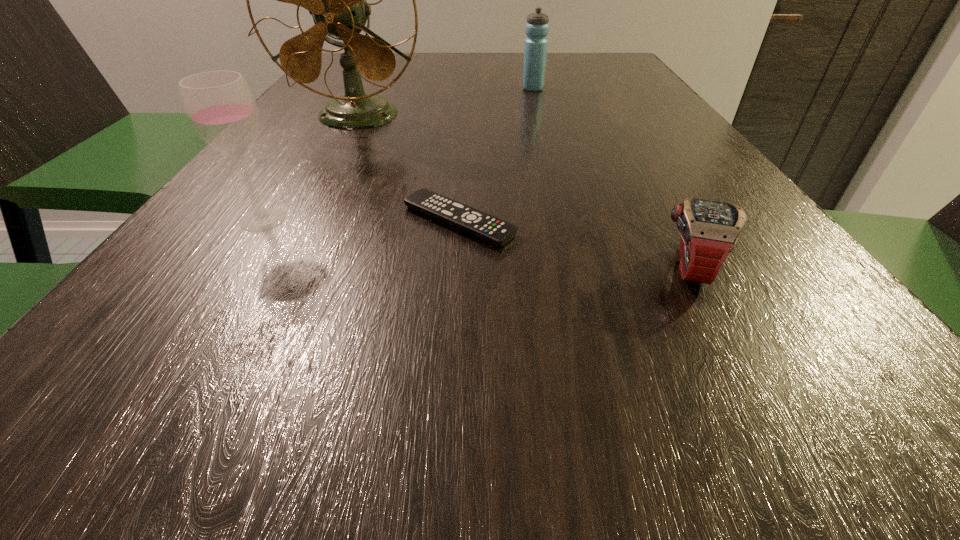
Find the location of a particular element. vacant region located 0.330m on the left of the farthest object is located at coordinates (387, 89).

This screenshot has width=960, height=540. In order to click on free location located 0.110m on the right of the watch in this screenshot , I will do `click(805, 267)`.

This screenshot has width=960, height=540. I want to click on free space located on the left of the remote control, so click(360, 221).

Locate an element on the screen. This screenshot has width=960, height=540. fan at the left edge is located at coordinates (336, 0).

What are the coordinates of `wineglass positioned at the left edge` in the screenshot? It's located at [x=220, y=106].

Identify the location of object present at the right edge. The width and height of the screenshot is (960, 540). (709, 230).

Find the location of a particular element. This screenshot has width=960, height=540. free space at the far edge is located at coordinates (503, 74).

This screenshot has height=540, width=960. Find the location of `vacant space at the near edge`. vacant space at the near edge is located at coordinates (205, 428).

Image resolution: width=960 pixels, height=540 pixels. In order to click on vacant area at the left edge of the desktop in this screenshot , I will do `click(336, 146)`.

In the image, there is a desktop. Where is `free space at the right edge`? Image resolution: width=960 pixels, height=540 pixels. free space at the right edge is located at coordinates (681, 138).